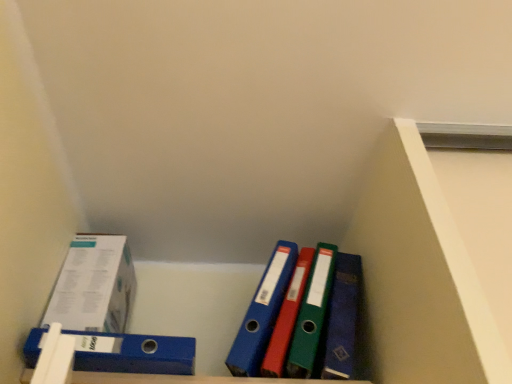
Question: From a real-world perspective, is white paperboard box at left on top of blue plastic binder at lower left?

Choices:
 (A) no
 (B) yes

Answer: (B)

Question: Is white paperboard box at left at the left side of blue plastic binder at lower left?

Choices:
 (A) no
 (B) yes

Answer: (B)

Question: Is white paperboard box at left positioned beyond the bounds of blue plastic binder at lower left?

Choices:
 (A) no
 (B) yes

Answer: (B)

Question: Considering the relative sizes of white paperboard box at left and blue plastic binder at lower left in the image provided, is white paperboard box at left shorter than blue plastic binder at lower left?

Choices:
 (A) no
 (B) yes

Answer: (A)

Question: Is white paperboard box at left further to the viewer compared to blue plastic binder at lower left?

Choices:
 (A) yes
 (B) no

Answer: (A)

Question: From a real-world perspective, is white paperboard box at left below blue plastic binder at lower left?

Choices:
 (A) yes
 (B) no

Answer: (B)

Question: Is the position of blue plastic binder at lower left more distant than that of white paperboard box at left?

Choices:
 (A) no
 (B) yes

Answer: (A)

Question: Is blue plastic binder at lower left at the left side of white paperboard box at left?

Choices:
 (A) no
 (B) yes

Answer: (A)

Question: Are blue plastic binder at lower left and white paperboard box at left located far from each other?

Choices:
 (A) yes
 (B) no

Answer: (B)

Question: From the image's perspective, would you say blue plastic binder at lower left is positioned over white paperboard box at left?

Choices:
 (A) no
 (B) yes

Answer: (A)

Question: Considering the relative positions of blue plastic binder at lower left and white paperboard box at left in the image provided, is blue plastic binder at lower left to the right of white paperboard box at left from the viewer's perspective?

Choices:
 (A) no
 (B) yes

Answer: (B)

Question: Is blue plastic binder at lower left positioned with its back to white paperboard box at left?

Choices:
 (A) no
 (B) yes

Answer: (A)

Question: Considering their positions, is blue plastic binder at lower left located in front of or behind white paperboard box at left?

Choices:
 (A) behind
 (B) front

Answer: (B)